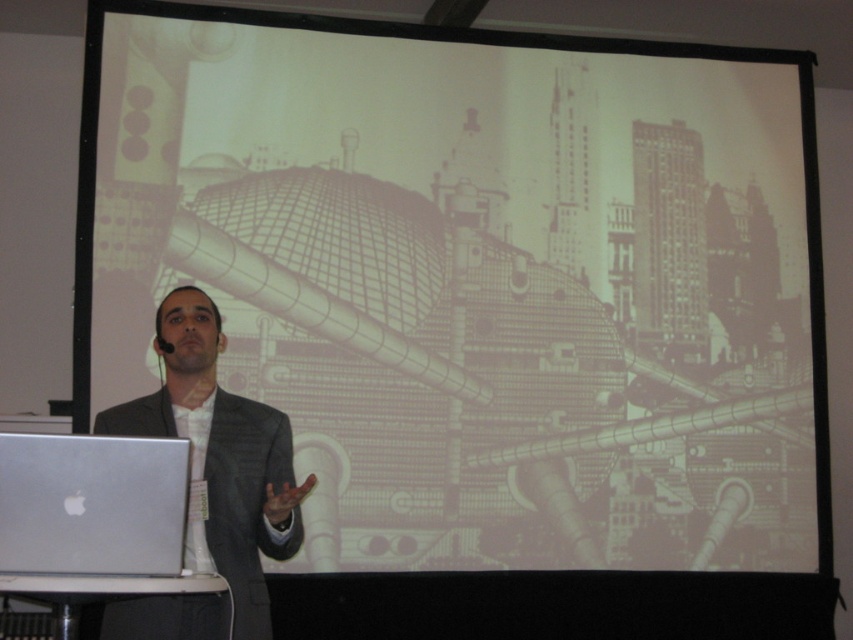
Does dark gray suit at center have a larger size compared to silver metallic laptop at lower left?

Correct, dark gray suit at center is larger in size than silver metallic laptop at lower left.

Does dark gray suit at center appear over silver metallic laptop at lower left?

Correct, dark gray suit at center is located above silver metallic laptop at lower left.

Which is in front, point (177, 406) or point (49, 435)?

Point (49, 435) is more forward.

The width and height of the screenshot is (853, 640). I want to click on dark gray suit at center, so click(x=221, y=454).